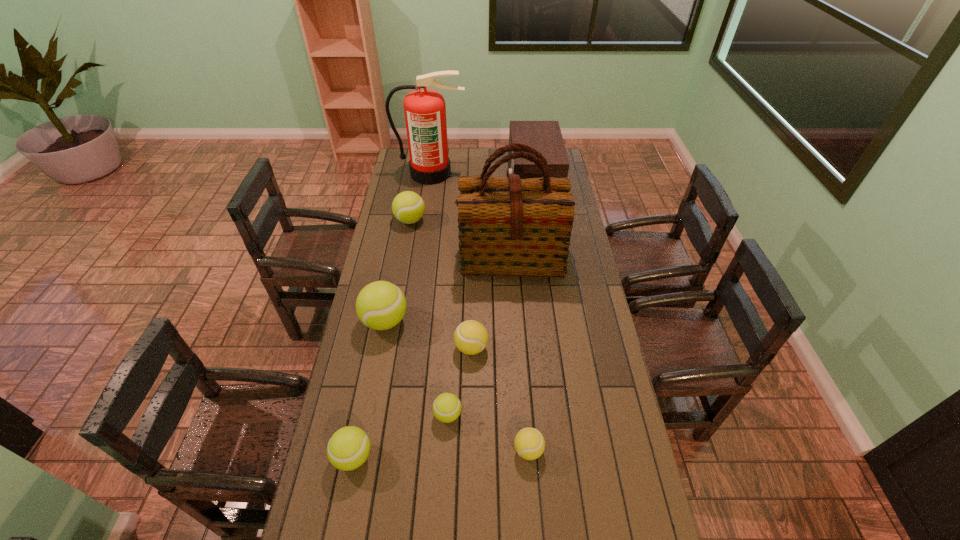
At what (x,y) coordinates should I click in order to perform the action: click on unoccupied position between the biggest green tennis ball and the fifth shortest object. Please return your answer as a coordinate pair (x, y). Looking at the image, I should click on (397, 271).

Identify which object is the eighth nearest to the rightmost green tennis ball. Please provide its 2D coordinates. Your answer should be formatted as a tuple, i.e. [(x, y)], where the tuple contains the x and y coordinates of a point satisfying the conditions above.

[(425, 111)]

Where is `object that is the fifth closest to the rightmost green tennis ball`? The height and width of the screenshot is (540, 960). object that is the fifth closest to the rightmost green tennis ball is located at coordinates (509, 226).

Where is `tennis ball that is the sixth closest to the shopping bag`? tennis ball that is the sixth closest to the shopping bag is located at coordinates (348, 448).

Where is `the fifth closest tennis ball to the third tallest object`? the fifth closest tennis ball to the third tallest object is located at coordinates (529, 443).

This screenshot has height=540, width=960. I want to click on green tennis ball that stands as the closest to the sixth nearest object, so click(x=408, y=207).

Identify the location of green tennis ball that stands as the closest to the seventh farthest object. The height and width of the screenshot is (540, 960). (348, 448).

The height and width of the screenshot is (540, 960). I want to click on free space that satisfies the following two spatial constraints: 1. on the front-facing side of the radio receiver; 2. on the open handle side of the shopping bag, so click(540, 256).

The width and height of the screenshot is (960, 540). I want to click on free space that satisfies the following two spatial constraints: 1. on the front side of the biggest green tennis ball; 2. on the left side of the bigger yellow tennis ball, so click(380, 348).

The width and height of the screenshot is (960, 540). I want to click on blank space that satisfies the following two spatial constraints: 1. on the front-facing side of the third tallest object; 2. on the open handle side of the fourth farthest object, so click(540, 256).